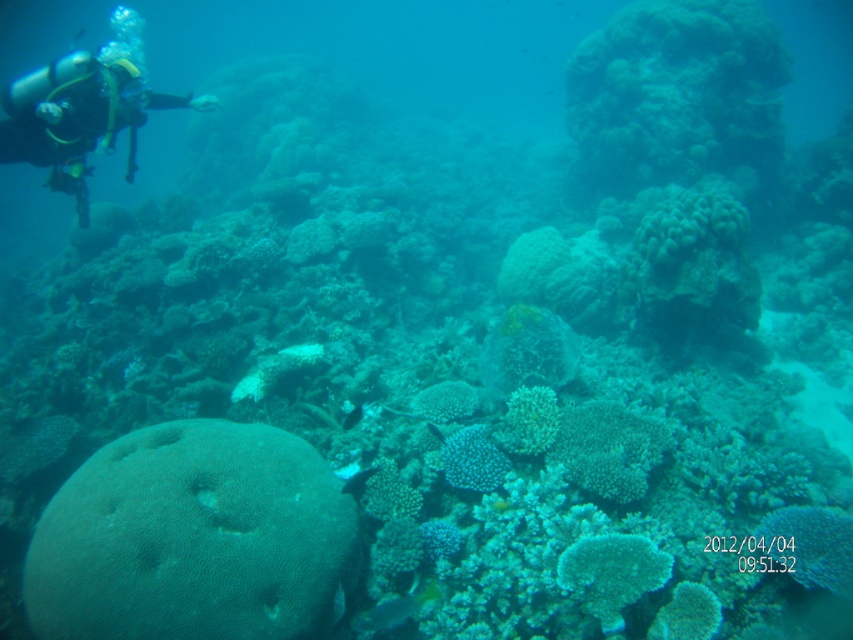
Is translucent white coral at center wider than yellow-green textured fish at lower center?

Incorrect, translucent white coral at center's width does not surpass yellow-green textured fish at lower center's.

Does translucent white coral at center appear under yellow-green textured fish at lower center?

Incorrect, translucent white coral at center is not positioned below yellow-green textured fish at lower center.

Identify the location of translucent white coral at center. (527, 420).

Does point (593, 566) come in front of point (386, 609)?

Yes, point (593, 566) is closer to viewer.

Can you confirm if green matte coral at center is thinner than yellow-green textured fish at lower center?

In fact, green matte coral at center might be wider than yellow-green textured fish at lower center.

Is point (579, 566) positioned in front of point (407, 593)?

Yes, it is in front of point (407, 593).

Locate an element on the screen. green matte coral at center is located at coordinates (612, 573).

Is point (178, 461) positioned after point (357, 618)?

No, (178, 461) is in front of (357, 618).

Is point (141, 445) farther from camera compared to point (384, 628)?

Yes.

What are the coordinates of `smooth brown coral at center` in the screenshot? It's located at (193, 538).